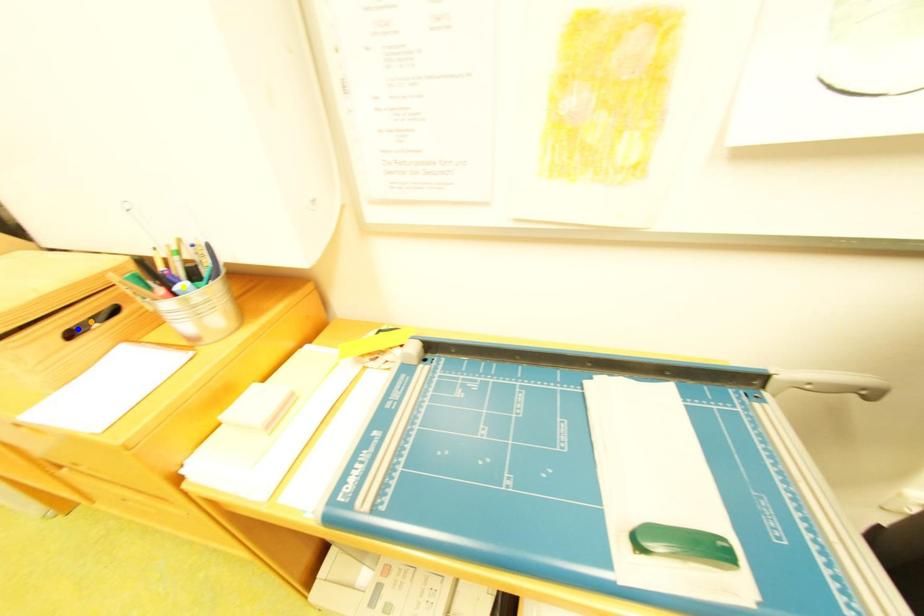
Order these from nearest to farthest:
A) blue point
B) orange point
C) yellow point

blue point, orange point, yellow point